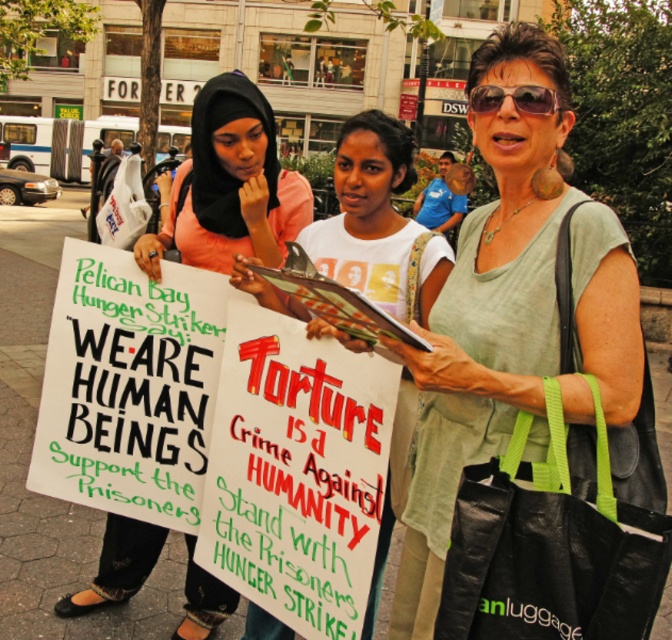
Based on the scene description, can you determine the spatial relationship between the white cotton shirt at center and the shiny black sunglasses at center?

The shiny black sunglasses at center is behind the white cotton shirt at center.

You are a photographer taking a picture of the protest. You notice the matte green shirt at center and the shiny black sunglasses at center. Which object is closer to the camera?

The matte green shirt at center is closer to the camera because it is in front of the shiny black sunglasses at center.